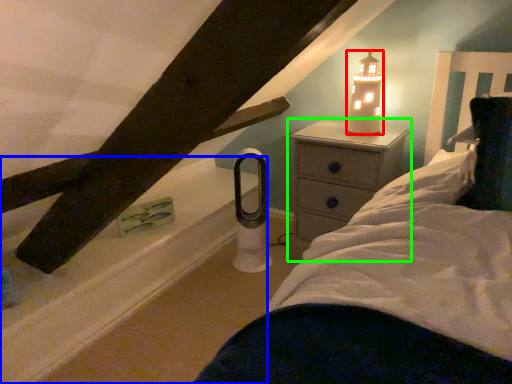
Question: Which object is the farthest from candle holder (highlighted by a red box)? Choose among these: window sill (highlighted by a blue box) or nightstand (highlighted by a green box).

Choices:
 (A) window sill
 (B) nightstand

Answer: (A)